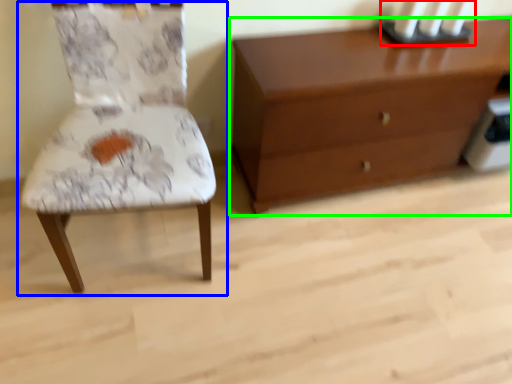
Question: Considering the real-world distances, which object is farthest from candle holder (highlighted by a red box)? chair (highlighted by a blue box) or chest of drawers (highlighted by a green box)?

Choices:
 (A) chair
 (B) chest of drawers

Answer: (A)